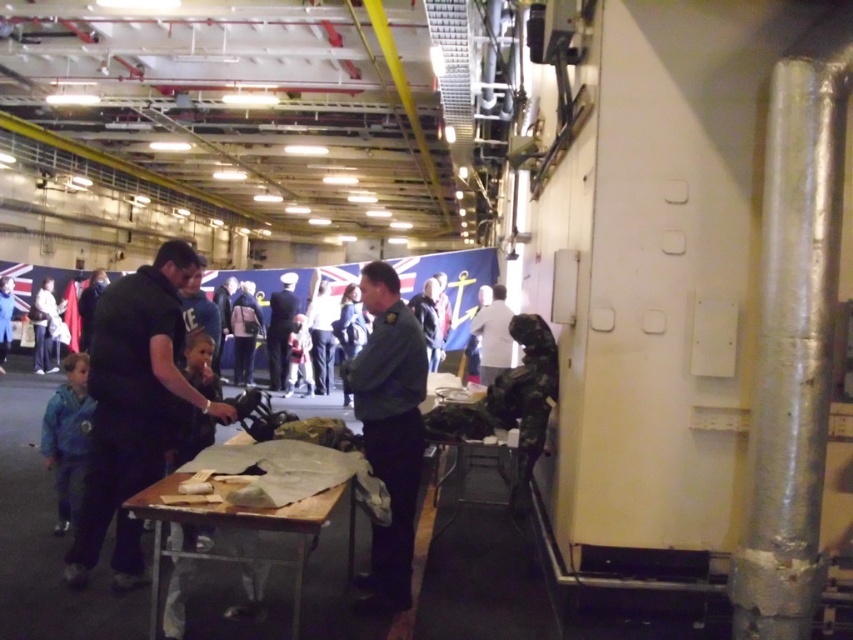
Question: Which of these objects is positioned farthest from the silver metallic pipe at right?

Choices:
 (A) white matte shirt at center
 (B) green uniform at center

Answer: (A)

Question: Which object is positioned farthest from the silver metallic pipe at right?

Choices:
 (A) green uniform at center
 (B) wooden table at center
 (C) black matte shirt at center
 (D) white matte shirt at center

Answer: (D)

Question: Considering the relative positions of black matte shirt at center and blue denim jacket at left in the image provided, where is black matte shirt at center located with respect to blue denim jacket at left?

Choices:
 (A) above
 (B) below

Answer: (A)

Question: Which object is farther from the camera taking this photo?

Choices:
 (A) wooden table at center
 (B) green uniform at center
 (C) blue denim jacket at left
 (D) black matte shirt at center

Answer: (C)

Question: Does silver metallic pipe at right lie in front of blue denim jacket at lower left?

Choices:
 (A) no
 (B) yes

Answer: (B)

Question: Can you confirm if black matte shirt at center is bigger than light blue denim jacket at upper left?

Choices:
 (A) yes
 (B) no

Answer: (A)